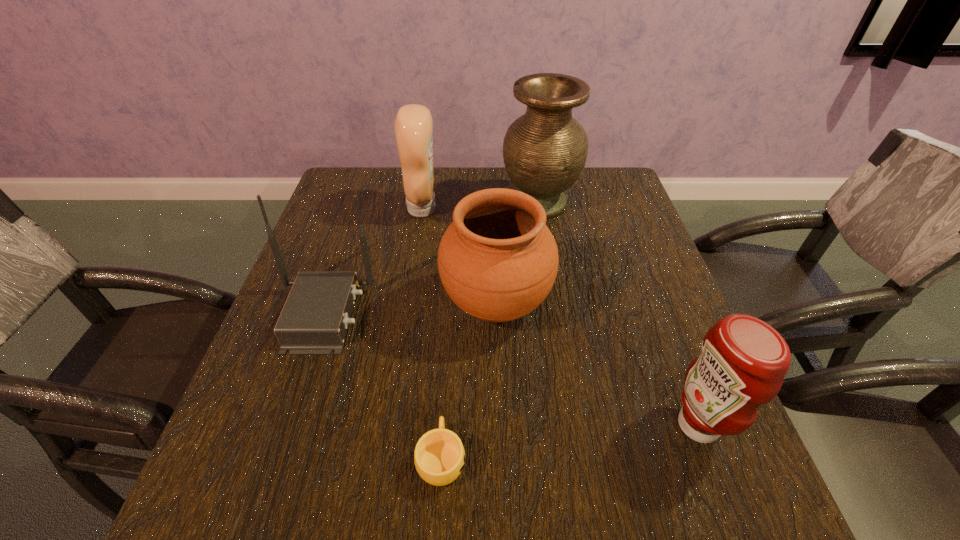
Find the location of a particular element. The image size is (960, 540). object situated at the far right corner is located at coordinates (545, 150).

In the image, there is a desktop. In order to click on vacant space at the far edge in this screenshot , I will do `click(396, 170)`.

You are a GUI agent. You are given a task and a screenshot of the screen. Output one action in this format:
    pyautogui.click(x=<x>, y=<y>)
    Task: Click on the blank area at the near edge
    
    Given the screenshot: What is the action you would take?
    625,528

Where is `vacant area at the left edge`? Image resolution: width=960 pixels, height=540 pixels. vacant area at the left edge is located at coordinates (274, 328).

At what (x,y) coordinates should I click in order to perform the action: click on vacant space at the right edge of the desktop. Please return your answer as a coordinate pair (x, y). The image size is (960, 540). Looking at the image, I should click on (688, 469).

In the image, there is a desktop. What are the coordinates of `vacant space at the far right corner` in the screenshot? It's located at point(606,170).

I want to click on vacant space at the near right corner of the desktop, so tap(706, 494).

Image resolution: width=960 pixels, height=540 pixels. What are the coordinates of `vacant region between the right condiment and the vase` in the screenshot? It's located at tap(618, 314).

This screenshot has width=960, height=540. I want to click on vacant area that lies between the vase and the leftmost object, so click(431, 259).

Find the location of a particular element. Image resolution: width=960 pixels, height=540 pixels. free space that is in between the router and the farther condiment is located at coordinates (373, 261).